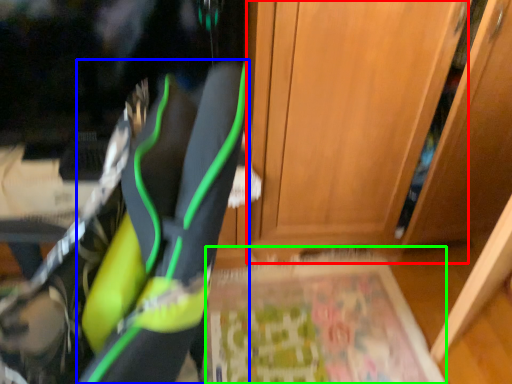
Question: Which object is the farthest from door (highlighted by a red box)? Choose among these: footwear (highlighted by a blue box) or yoga mat (highlighted by a green box).

Choices:
 (A) footwear
 (B) yoga mat

Answer: (A)